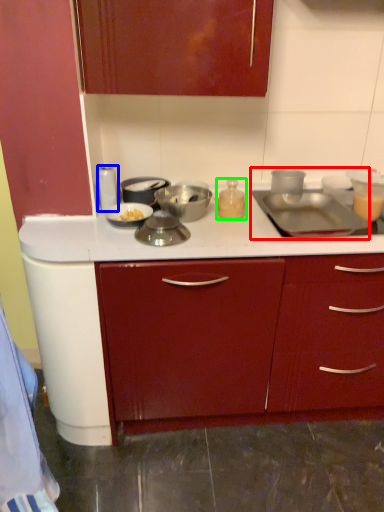
Question: Which object is the farthest from sink (highlighted by a red box)? Choose among these: kitchen appliance (highlighted by a blue box) or kitchen appliance (highlighted by a green box).

Choices:
 (A) kitchen appliance
 (B) kitchen appliance

Answer: (A)